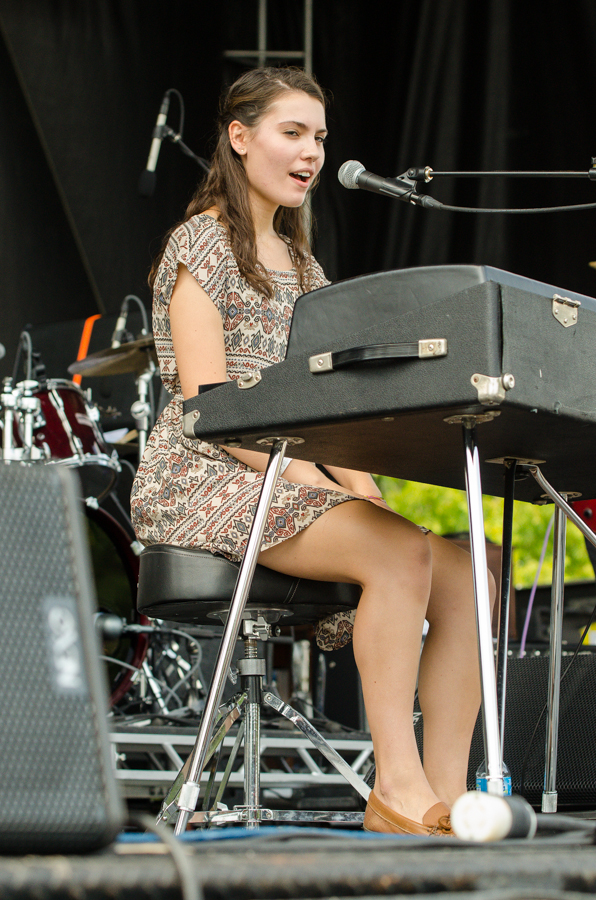
The image size is (596, 900). What are the coordinates of `piano legs` in the screenshot? It's located at (216, 709), (489, 690), (548, 699).